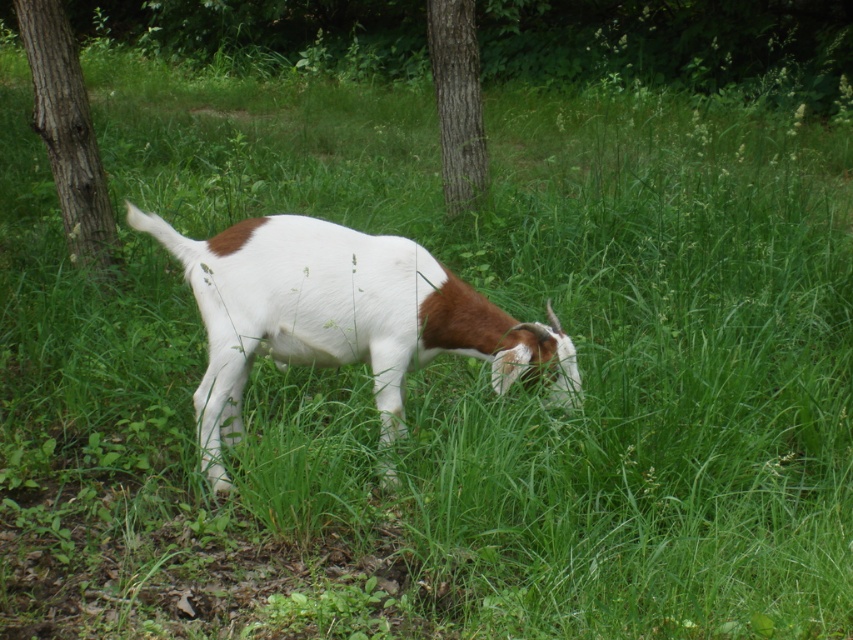
You are a hiker who just entered a field and see the white soft fur goat at center and the brown rough bark tree at center. You want to take a photo of both in the same frame. Which direction should you move to ensure both are visible in your camera view?

To capture both the white soft fur goat at center and the brown rough bark tree at center in the same frame, you should move backward since the distance between them is 2.63 meters. Moving back will widen your field of view, allowing both subjects to be included in the photo.

You are standing in the field and see the point at coordinates (67, 131). Which object in the scene does this point belong to?

The point at coordinates (67, 131) is on the brown rough bark at left.

You are a photographer standing in the field and want to take a picture of the white soft fur goat at center and the brown rough bark tree at center. Which object will appear larger in the photo?

The white soft fur goat at center will appear larger in the photo because it is closer to the viewer than the brown rough bark tree at center.